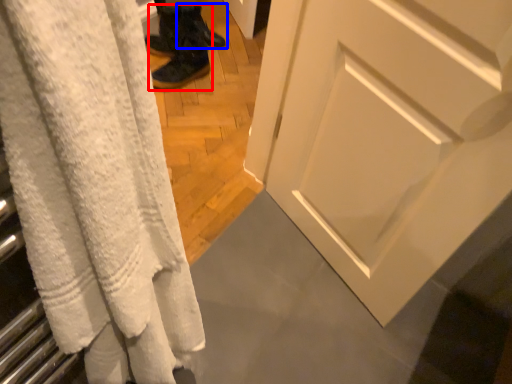
Question: Which object appears closest to the camera in this image, footwear (highlighted by a red box) or footwear (highlighted by a blue box)?

Choices:
 (A) footwear
 (B) footwear

Answer: (A)